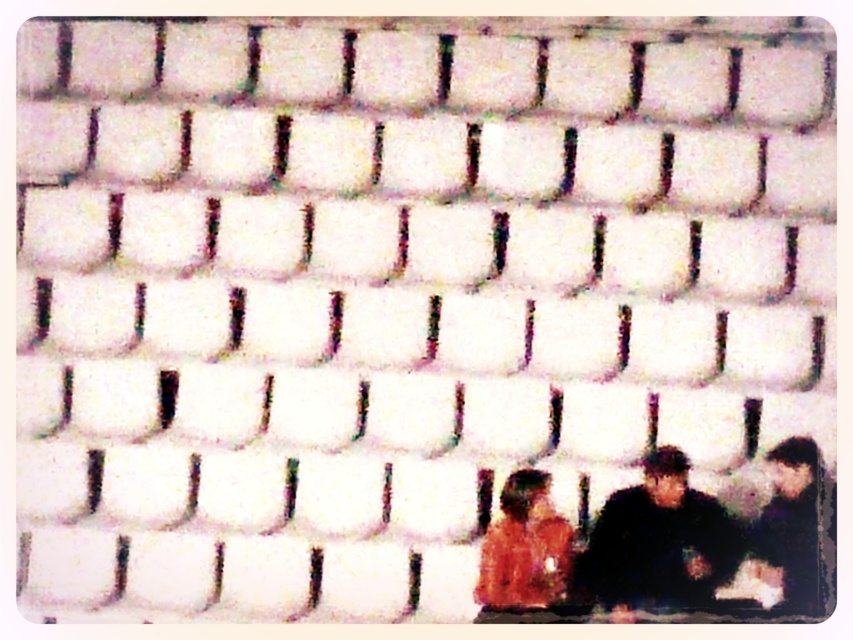
The width and height of the screenshot is (853, 640). Find the location of `dark gray fabric jacket at lower right`. dark gray fabric jacket at lower right is located at coordinates (659, 541).

Is point (704, 522) farther from camera compared to point (492, 534)?

No.

The height and width of the screenshot is (640, 853). I want to click on dark gray fabric jacket at lower right, so click(x=659, y=541).

Does orange fabric shirt at lower right have a smaller size compared to dark gray sweater at right?

Yes.

Is orange fabric shirt at lower right further to the viewer compared to dark gray sweater at right?

That is True.

Find the location of a particular element. Image resolution: width=853 pixels, height=640 pixels. orange fabric shirt at lower right is located at coordinates (525, 548).

Measure the distance between orange fabric couple at lower right and dark gray fabric jacket at lower right.

A distance of 1.06 inches exists between orange fabric couple at lower right and dark gray fabric jacket at lower right.

Based on the photo, can you confirm if orange fabric couple at lower right is positioned above dark gray fabric jacket at lower right?

Indeed, orange fabric couple at lower right is positioned over dark gray fabric jacket at lower right.

Does point (527, 598) come behind point (622, 512)?

That is False.

The image size is (853, 640). I want to click on orange fabric couple at lower right, so point(662,547).